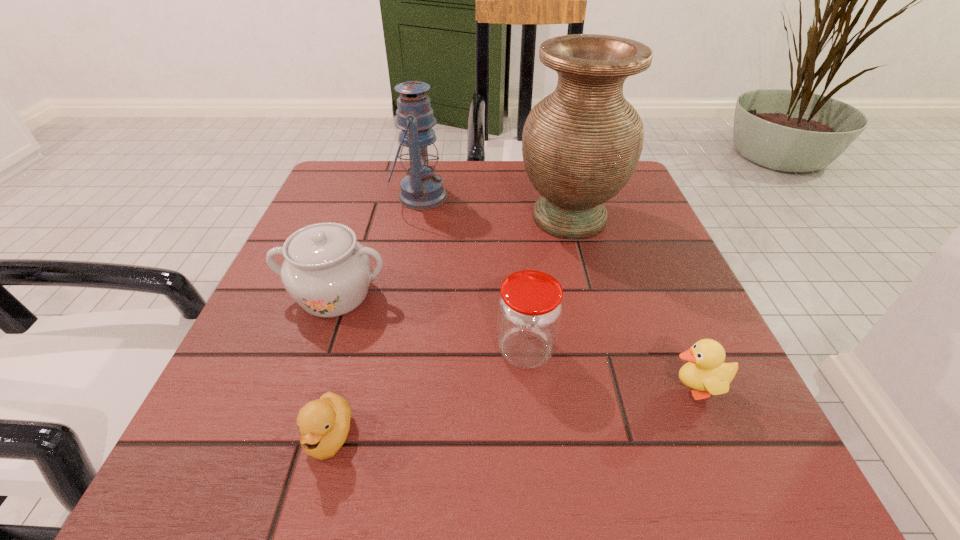
The image size is (960, 540). Find the location of `vase`. vase is located at coordinates (581, 144).

Image resolution: width=960 pixels, height=540 pixels. In order to click on the fifth shortest object in this screenshot , I will do `click(421, 189)`.

Locate an element on the screen. The width and height of the screenshot is (960, 540). the fourth nearest object is located at coordinates (327, 272).

Identify the location of jar. (530, 307).

You are a GUI agent. You are given a task and a screenshot of the screen. Output one action in this format:
    pyautogui.click(x=<x>, y=<y>)
    Task: Click on the right duckling
    The height and width of the screenshot is (540, 960).
    Given the screenshot: What is the action you would take?
    pyautogui.click(x=705, y=371)

Find the location of a particular element. The image size is (960, 540). the taller duckling is located at coordinates (705, 371).

This screenshot has height=540, width=960. I want to click on the left duckling, so click(x=324, y=423).

Locate an element on the screen. Image resolution: width=960 pixels, height=540 pixels. the shortest object is located at coordinates (324, 423).

Identify the location of blank space located 0.120m on the front of the tallest object. (588, 292).

At what (x,y) coordinates should I click in order to perform the action: click on free location located on the front-facing side of the lantern. Please return your answer as a coordinate pair (x, y). The image size is (960, 540). Looking at the image, I should click on (613, 197).